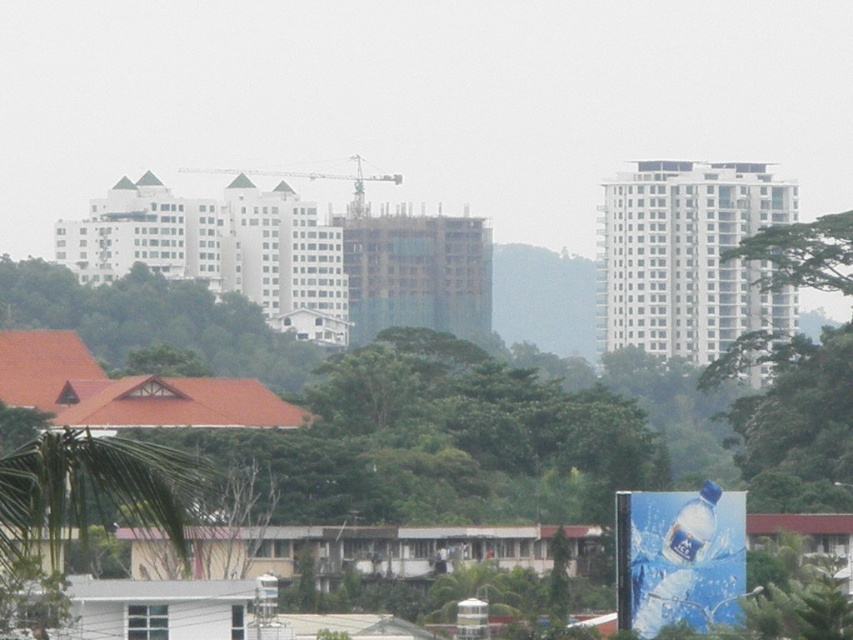
Question: Observing the image, what is the correct spatial positioning of green leafy tree at right in reference to green leafy tree at lower left?

Choices:
 (A) above
 (B) below

Answer: (A)

Question: In this image, where is green leafy tree at right located relative to green leafy tree at lower left?

Choices:
 (A) right
 (B) left

Answer: (A)

Question: Which of the following is the farthest from the observer?

Choices:
 (A) green leafy tree at right
 (B) green leafy tree at lower left

Answer: (A)

Question: Which of the following is the farthest from the observer?

Choices:
 (A) green leafy tree at lower left
 (B) green leafy tree at right

Answer: (B)

Question: In this image, where is green leafy tree at right located relative to green leafy tree at lower left?

Choices:
 (A) right
 (B) left

Answer: (A)